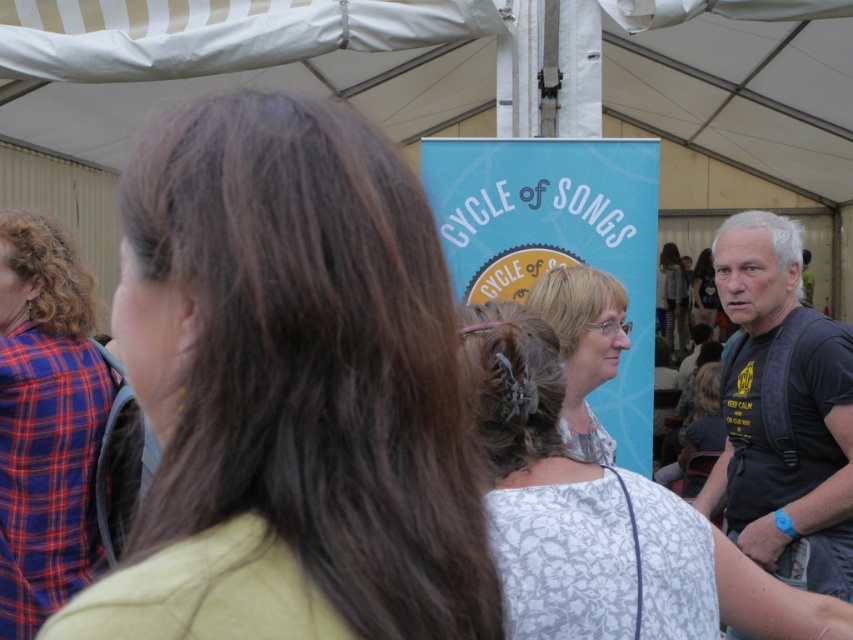
You are standing at the entrance of the tent and want to locate two specific points marked in the image. The first point is at coordinates point (15, 618) and the second is at point (680, 314). Which point is closer to you?

Point (15, 618) is closer to the viewer than point (680, 314).